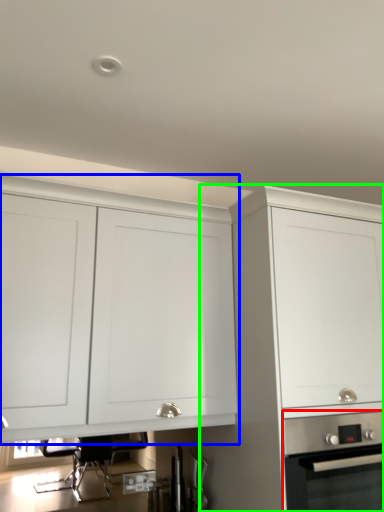
Question: Based on their relative distances, which object is farther from home appliance (highlighted by a red box)? Choose from cabinetry (highlighted by a blue box) and cabinetry (highlighted by a green box).

Choices:
 (A) cabinetry
 (B) cabinetry

Answer: (A)